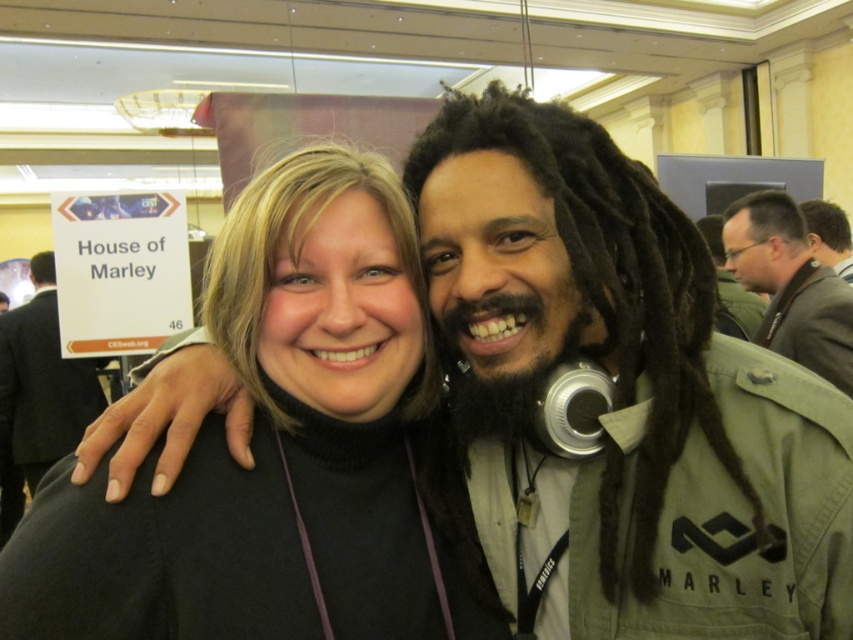
Question: Does brown leather jacket at upper right appear on the right side of dark brown hair at upper right?

Choices:
 (A) no
 (B) yes

Answer: (A)

Question: Which of the following is the closest to the observer?

Choices:
 (A) (711, 236)
 (B) (207, 296)
 (C) (57, 397)
 (D) (785, 316)

Answer: (B)

Question: Among these points, which one is nearest to the camera?

Choices:
 (A) (722, 240)
 (B) (21, 403)
 (C) (718, 253)
 (D) (370, 321)

Answer: (D)

Question: Which object is the farthest from the black turtleneck sweater at center?

Choices:
 (A) brown leather jacket at upper right
 (B) dark green fabric jacket at center
 (C) dark brown hair at upper right
 (D) matte gray jacket at upper right

Answer: (B)

Question: Is brown leather jacket at upper right positioned at the back of dark brown hair at upper right?

Choices:
 (A) no
 (B) yes

Answer: (A)

Question: Does brown leather jacket at upper right appear over matte gray jacket at upper right?

Choices:
 (A) yes
 (B) no

Answer: (B)